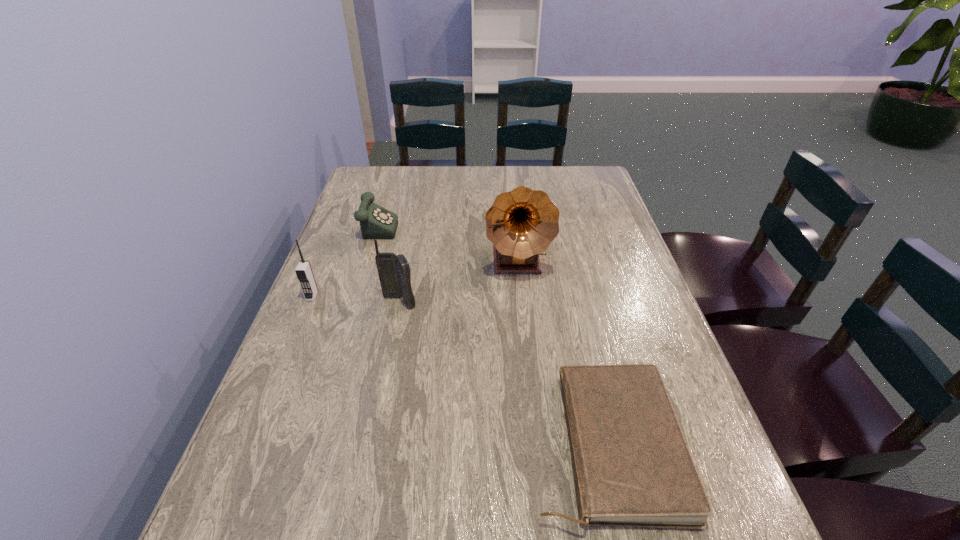
You are a GUI agent. You are given a task and a screenshot of the screen. Output one action in this format:
    pyautogui.click(x=<x>, y=<y>)
    Task: Click on the vacant position located on the dial of the second shortest object
    The height and width of the screenshot is (540, 960).
    Given the screenshot: What is the action you would take?
    pyautogui.click(x=486, y=224)

The height and width of the screenshot is (540, 960). What are the coordinates of `vacant area located 0.300m on the spine side of the nearest object` in the screenshot? It's located at (364, 445).

The width and height of the screenshot is (960, 540). In order to click on vacant space located on the spine side of the nearest object in this screenshot , I will do `click(459, 445)`.

Where is `vacant point located on the spine side of the nearest object`? This screenshot has width=960, height=540. vacant point located on the spine side of the nearest object is located at coordinates (420, 445).

Find the location of a particular element. This screenshot has height=540, width=960. cellular telephone situated at the left edge is located at coordinates (304, 273).

Locate an element on the screen. The width and height of the screenshot is (960, 540). telephone that is at the left edge is located at coordinates (376, 222).

Find the location of a particular element. object that is at the right edge is located at coordinates (632, 467).

You are a GUI agent. You are given a task and a screenshot of the screen. Output one action in this format:
    pyautogui.click(x=<x>, y=<y>)
    Task: Click on the vacant area at the far edge
    The height and width of the screenshot is (540, 960).
    Given the screenshot: What is the action you would take?
    pyautogui.click(x=461, y=180)

Locate an element on the screen. The height and width of the screenshot is (540, 960). free location at the left edge is located at coordinates (370, 241).

This screenshot has width=960, height=540. I want to click on vacant region at the right edge, so click(598, 262).